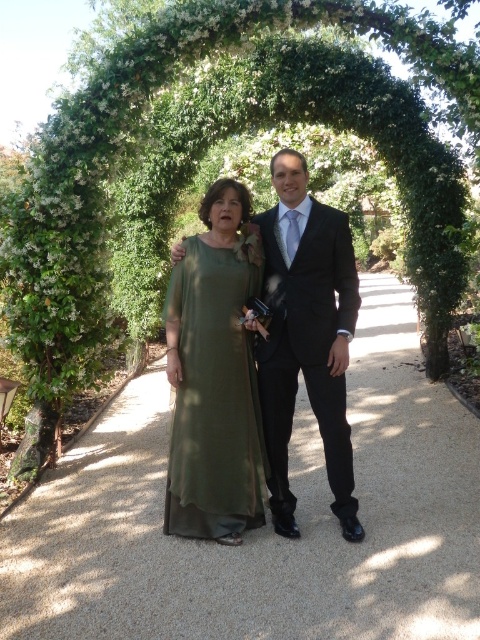
You are a photographer at a garden event. You need to position two subjects so that one is closer to the camera than the other. The subjects are wearing a matte green dress at center and a black satin suit at center. Which subject should you place in front to ensure the other appears farther away?

To ensure the black satin suit at center appears farther away, you should place the matte green dress at center in front of it.

You are a photographer at a garden event and need to position two guests for a photo. The guests are wearing a matte green dress at center and a black satin suit at center. Based on their current positions, which guest is standing to the right of the other?

The matte green dress at center is to the right of the black satin suit at center, so the guest in the matte green dress is positioned to the right of the guest in the black satin suit.

You are standing at the gravel pathway at center. You want to walk to the archway behind you. How many steps would you need to take to reach the archway if each step covers 0.8 meters?

The gravel pathway at center and viewer are 3.80 meters apart. Since each step covers 0.8 meters, dividing 3.80 by 0.8 gives approximately 4.75 steps. Therefore, you would need to take 5 steps to reach the archway.